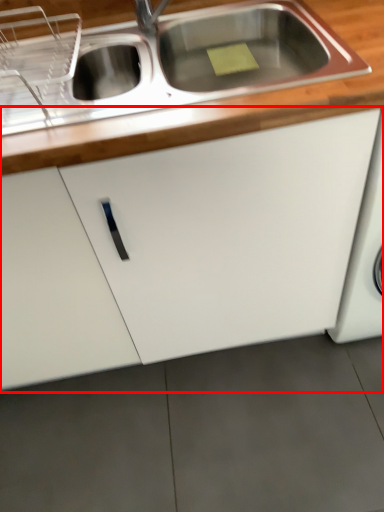
Question: In this image, where is cabinetry (annotated by the red box) located relative to countertop?

Choices:
 (A) left
 (B) right

Answer: (A)